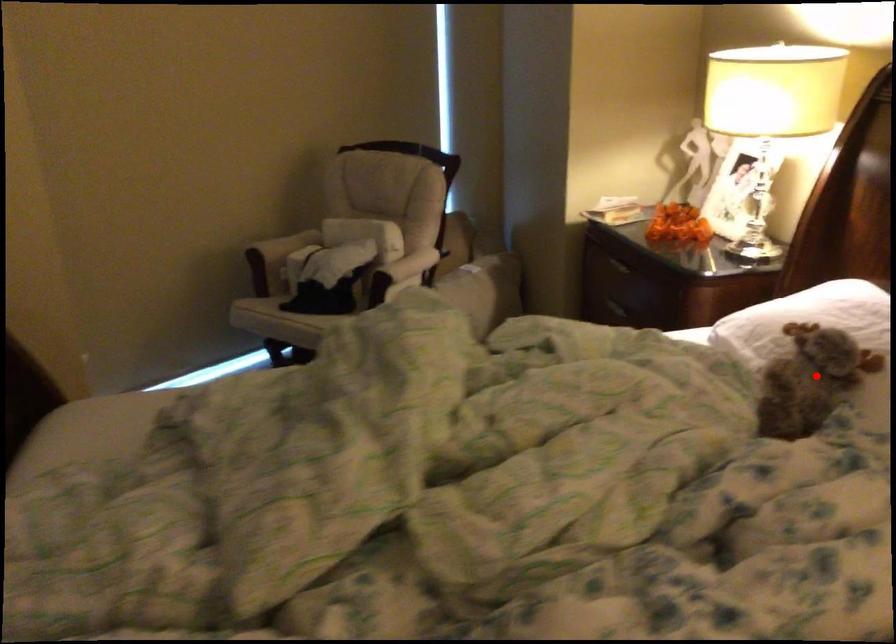
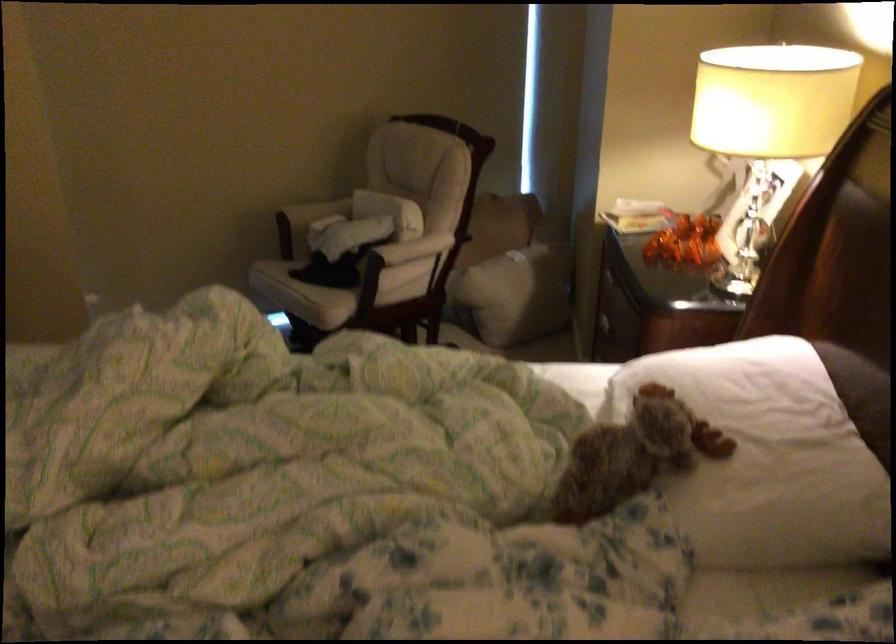
Question: A red point is marked in image1. In image2, is the corresponding 3D point closer to the camera or farther? Reply with the corresponding letter.

Choices:
 (A) The corresponding 3D point is closer.
 (B) The corresponding 3D point is farther.

Answer: (A)